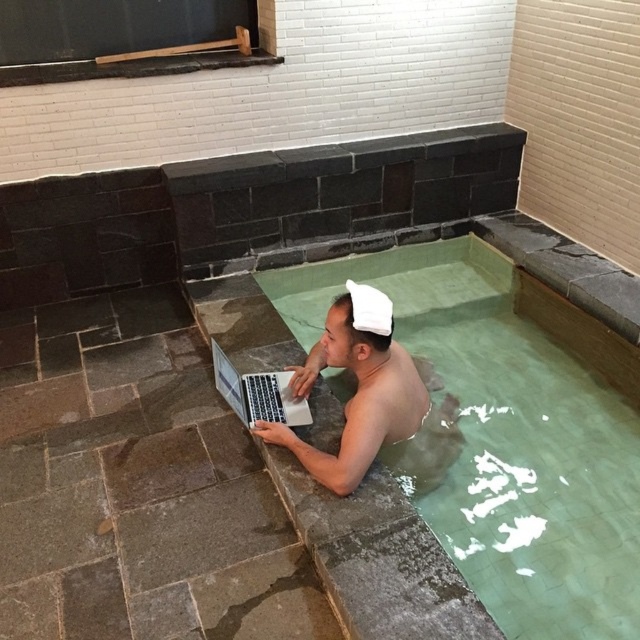
You are standing in front of a hot spring bath and want to place a small decorative plant at point (296, 440). If you are 1.94 meters away from that point, can you reach it without moving closer?

The distance of point (296, 440) from viewer is 1.94 meters. Since you are exactly at that distance, you can reach it without moving closer.

You are a photographer taking a picture of the scene. You need to ensure both the silver metallic laptop at center and the white fabric baseball hat at upper center are clearly visible in the frame. Based on their positions, which object is closer to the bottom of the image?

The silver metallic laptop at center is located below the white fabric baseball hat at upper center, so the silver metallic laptop at center is closer to the bottom of the image.